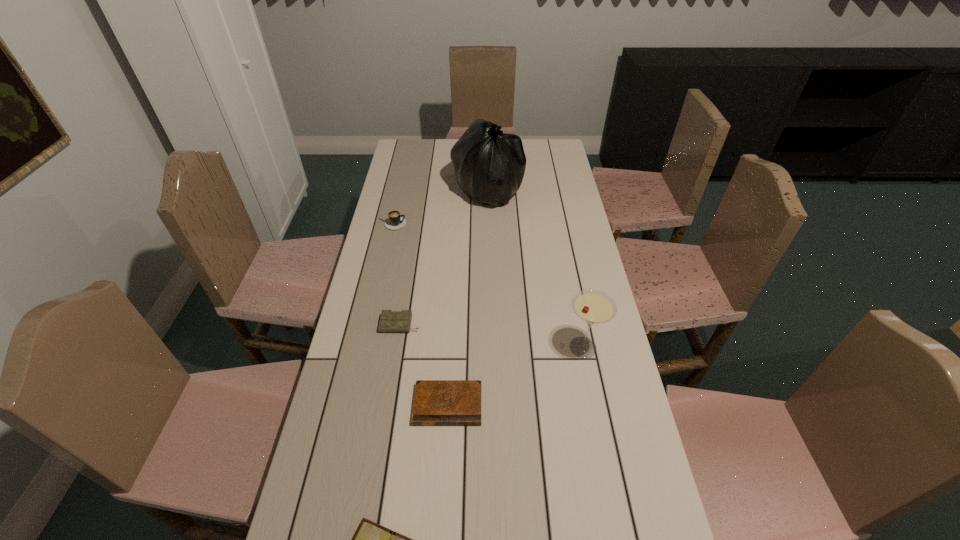
Identify the location of vacant space located 0.180m on the left of the martini. (501, 348).

The image size is (960, 540). I want to click on vacant space located 0.190m with the handle on the side of the second farthest object, so click(x=455, y=224).

This screenshot has width=960, height=540. Identify the location of free location located 0.050m on the right of the tallest diary. (436, 325).

This screenshot has height=540, width=960. Identify the location of vacant area located on the spine side of the second nearest diary. (442, 511).

At what (x,y) coordinates should I click in order to perform the action: click on cappuccino that is at the left edge. Please return your answer as a coordinate pair (x, y). Looking at the image, I should click on (395, 221).

What are the coordinates of `diary that is positioned at the left edge` in the screenshot? It's located at (390, 321).

Where is `object that is at the right edge`? This screenshot has height=540, width=960. object that is at the right edge is located at coordinates (594, 307).

Image resolution: width=960 pixels, height=540 pixels. I want to click on vacant point at the left edge, so click(x=375, y=325).

At what (x,y) coordinates should I click in order to perform the action: click on vacant point at the right edge. Please return your answer as a coordinate pair (x, y). Looking at the image, I should click on (547, 268).

Locate an element on the screen. The width and height of the screenshot is (960, 540). empty location between the second farthest diary and the tallest diary is located at coordinates (424, 364).